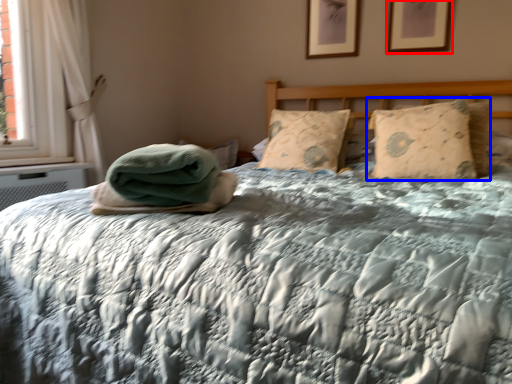
Question: Among these objects, which one is farthest to the camera, picture frame (highlighted by a red box) or pillow (highlighted by a blue box)?

Choices:
 (A) picture frame
 (B) pillow

Answer: (A)